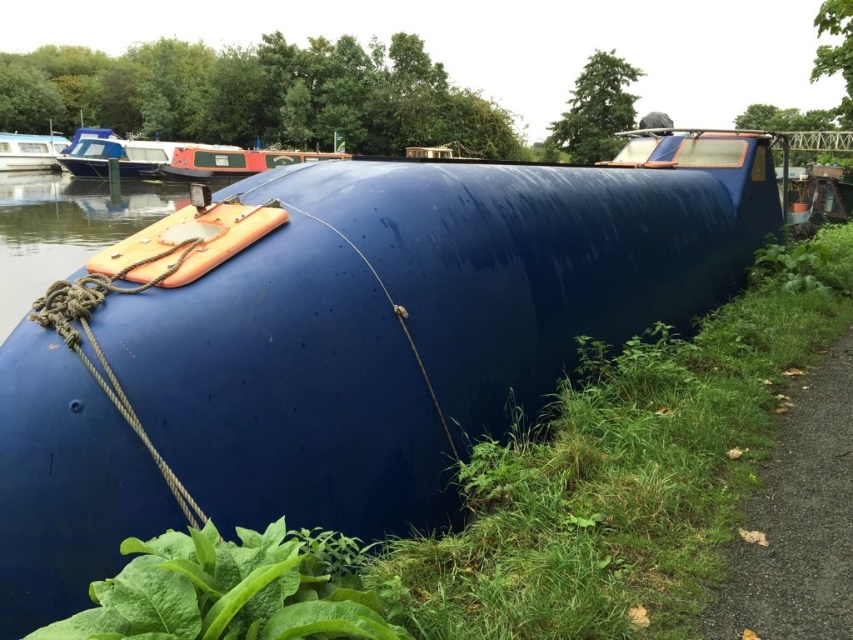
Question: From the image, what is the correct spatial relationship of gravel path at lower right in relation to matte blue boat at upper left?

Choices:
 (A) above
 (B) below

Answer: (B)

Question: Which of the following is the farthest from the observer?

Choices:
 (A) green grass at lower right
 (B) matte orange buoy at upper left

Answer: (B)

Question: Does green leafy plant at lower center appear on the right side of matte orange buoy at center?

Choices:
 (A) yes
 (B) no

Answer: (A)

Question: Estimate the real-world distances between objects in this image. Which object is farther from the green grass at lower right?

Choices:
 (A) gravel path at lower right
 (B) matte blue boat at upper left
 (C) matte orange buoy at upper left

Answer: (B)

Question: Which is nearer to the matte orange buoy at upper left?

Choices:
 (A) green grass at lower right
 (B) matte orange buoy at center

Answer: (B)

Question: Where is green leafy plant at lower center located in relation to matte blue boat at upper left in the image?

Choices:
 (A) above
 (B) below

Answer: (B)